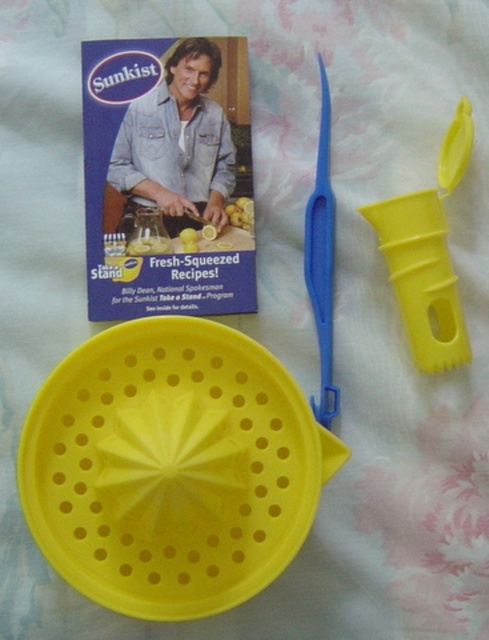
You are setting up a lemon juicing station and need to place the yellow matte strainer at center and the yellow plastic juicer at right on a counter. If the counter space is limited, which item should you place closer to the edge to save space?

The yellow plastic juicer at right should be placed closer to the edge because its width is smaller than the yellow matte strainer at center, allowing for more space conservation.

In the scene shown: You are setting up a lemonade stand and need to arrange the lemon squeezer parts properly. According to the image, where is the yellow matte strainer at center in relation to the blue plastic scissors at upper center?

The yellow matte strainer at center is positioned under the blue plastic scissors at upper center.